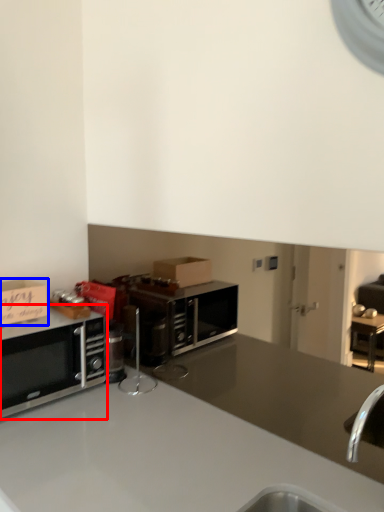
Question: Which of the following is the farthest to the observer, microwave oven (highlighted by a red box) or cabinetry (highlighted by a blue box)?

Choices:
 (A) microwave oven
 (B) cabinetry

Answer: (B)